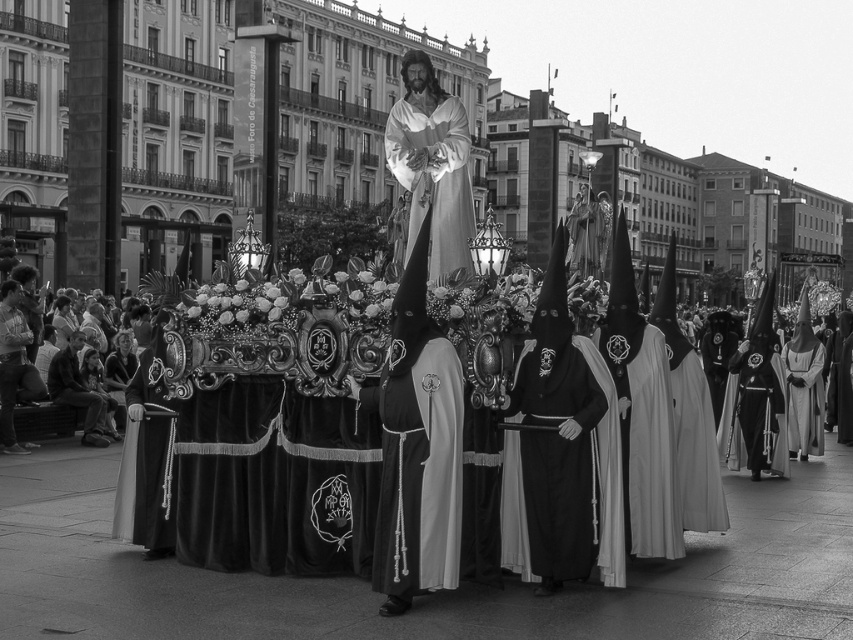
Question: Which of the following is the farthest from the observer?

Choices:
 (A) smooth skin face at lower left
 (B) smooth fabric man at lower left
 (C) smooth black robe at center

Answer: (A)

Question: Which point appears closest to the camera in this image?

Choices:
 (A) (160, 477)
 (B) (114, 356)
 (C) (514, 518)
 (D) (454, 115)

Answer: (C)

Question: Does velvet black robe at center appear over silky white robe at center?

Choices:
 (A) yes
 (B) no

Answer: (B)

Question: Is smooth fabric man at lower left in front of silky white robe at center?

Choices:
 (A) yes
 (B) no

Answer: (B)

Question: Where is smooth black robe at center located in relation to velvet black robe at center in the image?

Choices:
 (A) right
 (B) left

Answer: (B)

Question: Which point is farther to the camera?

Choices:
 (A) (149, 416)
 (B) (57, 369)
 (C) (605, 461)

Answer: (B)